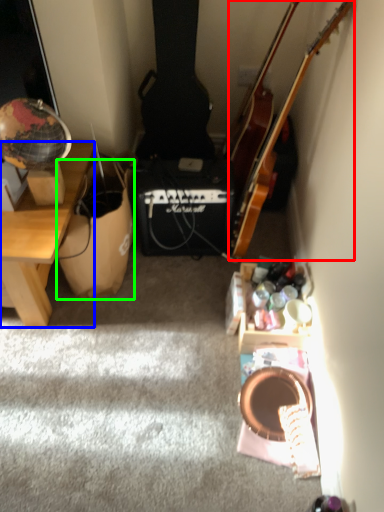
Question: Considering the real-world distances, which object is closest to guitar (highlighted by a red box)? desk (highlighted by a blue box) or cardboard box (highlighted by a green box).

Choices:
 (A) desk
 (B) cardboard box

Answer: (B)